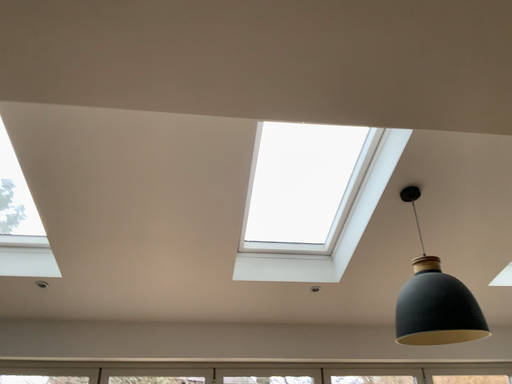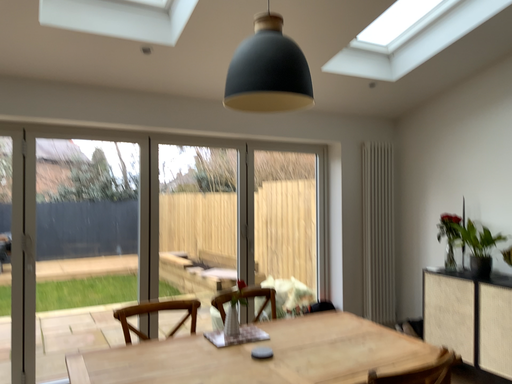
Question: How did the camera likely rotate when shooting the video?

Choices:
 (A) rotated downward
 (B) rotated upward

Answer: (A)